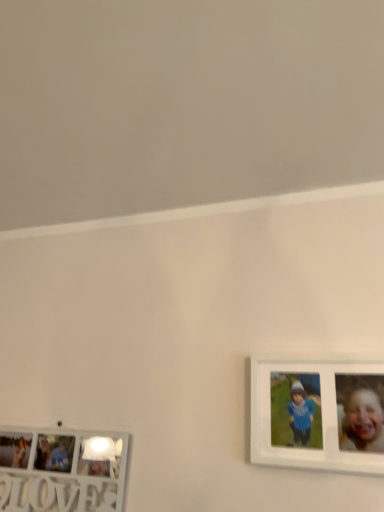
Question: Considering the positions of white matte picture frame at right, positioned as the 2th picture frame in bottom-to-top order, and white wooden picture frame at lower left, which is the first picture frame in left-to-right order, in the image, is white matte picture frame at right, positioned as the 2th picture frame in bottom-to-top order, bigger or smaller than white wooden picture frame at lower left, which is the first picture frame in left-to-right order,?

Choices:
 (A) small
 (B) big

Answer: (A)

Question: Considering the positions of white matte picture frame at right, the 1th picture frame viewed from the right, and white wooden picture frame at lower left, acting as the second picture frame starting from the right, in the image, is white matte picture frame at right, the 1th picture frame viewed from the right, wider or thinner than white wooden picture frame at lower left, acting as the second picture frame starting from the right,?

Choices:
 (A) wide
 (B) thin

Answer: (A)

Question: Is white matte picture frame at right, positioned as the 2th picture frame in bottom-to-top order, to the left or to the right of white wooden picture frame at lower left, which is the first picture frame in left-to-right order, in the image?

Choices:
 (A) right
 (B) left

Answer: (A)

Question: From their relative heights in the image, would you say white wooden picture frame at lower left, which is the 2th picture frame from top to bottom, is taller or shorter than white matte picture frame at right, the 1th picture frame viewed from the right?

Choices:
 (A) tall
 (B) short

Answer: (B)

Question: Would you say white wooden picture frame at lower left, which is the 2th picture frame from top to bottom, is to the left or to the right of white matte picture frame at right, the 1th picture frame viewed from the right, in the picture?

Choices:
 (A) left
 (B) right

Answer: (A)

Question: From a real-world perspective, is white wooden picture frame at lower left, which is the first picture frame in left-to-right order, above or below white matte picture frame at right, the 1th picture frame viewed from the right?

Choices:
 (A) below
 (B) above

Answer: (A)

Question: Is point (102, 442) positioned closer to the camera than point (278, 432)?

Choices:
 (A) closer
 (B) farther

Answer: (B)